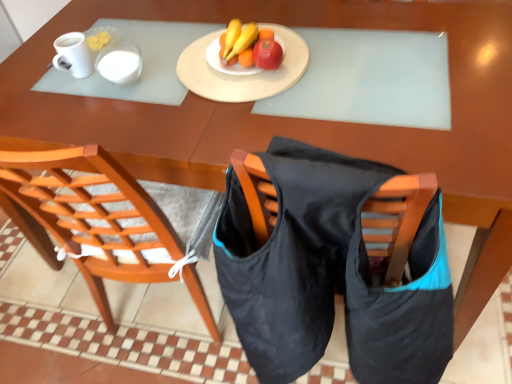
At what (x,y) coordinates should I click in order to perform the action: click on vacant point to the left of matte yellow banana at center. Please return your answer as a coordinate pair (x, y). Image resolution: width=512 pixels, height=384 pixels. Looking at the image, I should click on pos(167,62).